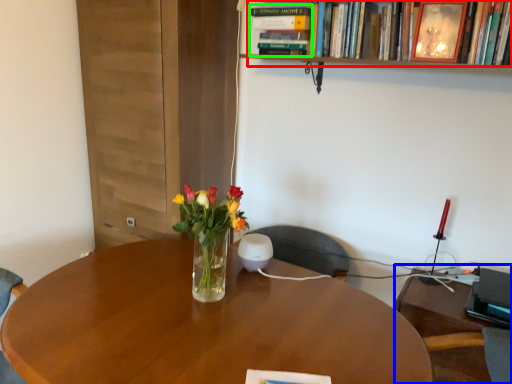
Question: Estimate the real-world distances between objects in this image. Which object is closer to book (highlighted by a red box), computer desk (highlighted by a blue box) or book (highlighted by a green box)?

Choices:
 (A) computer desk
 (B) book

Answer: (B)